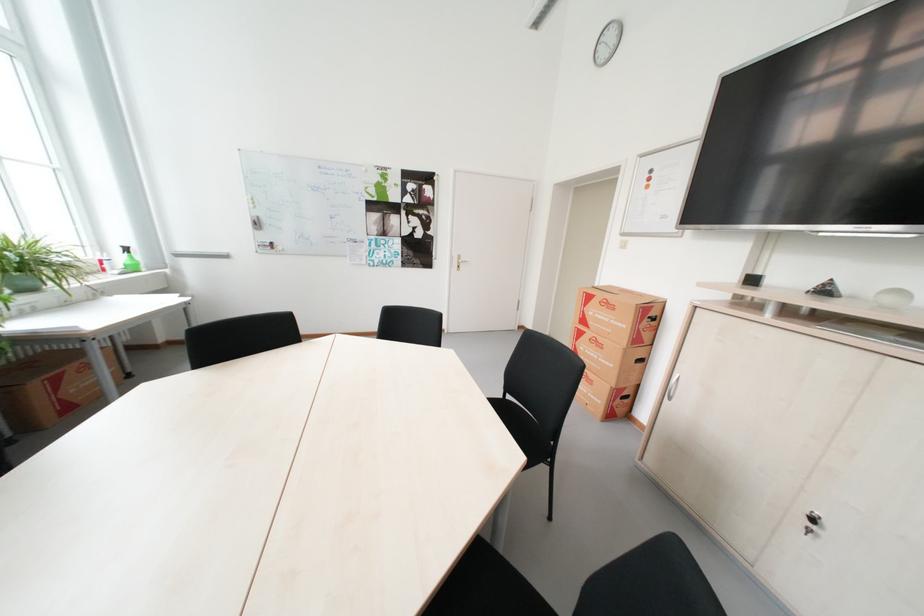
Find where to turn the cabinet key. Please return your answer as a coordinate pair (x, y).

(816, 538)